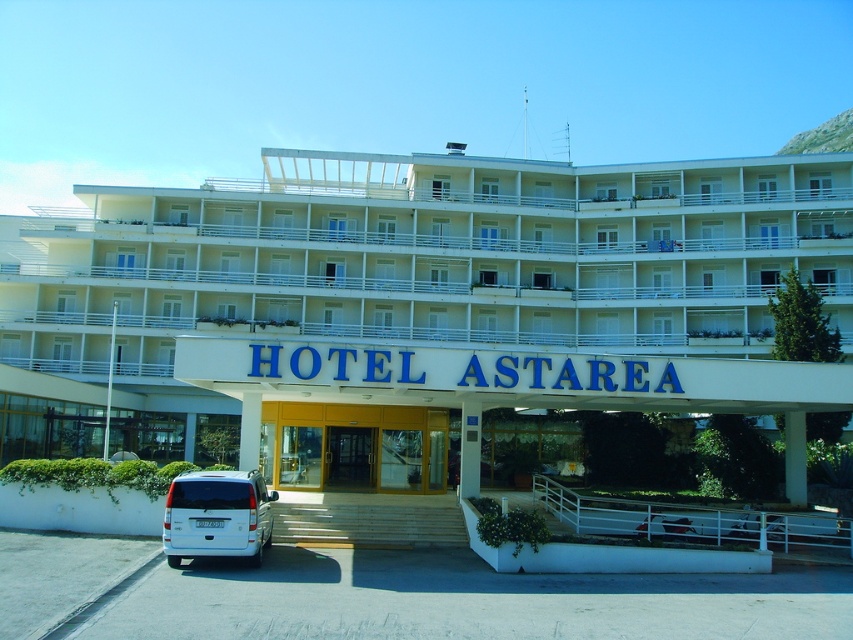
You are standing at the entrance of Hotel Astarea and need to park your car. There is a white matte van at lower left and a wooden door at center. Which object is closer to you as you face the hotel?

The white matte van at lower left is closer to you because it is in front of the wooden door at center.

You are standing at the entrance of Hotel Astarea and need to park your car in the parking area. You see a white glossy building at center and a wooden door at center. Which object is closer to you as you face the entrance?

The wooden door at center is closer to you because the white glossy building at center is in front of it, meaning the door is behind the building structure.